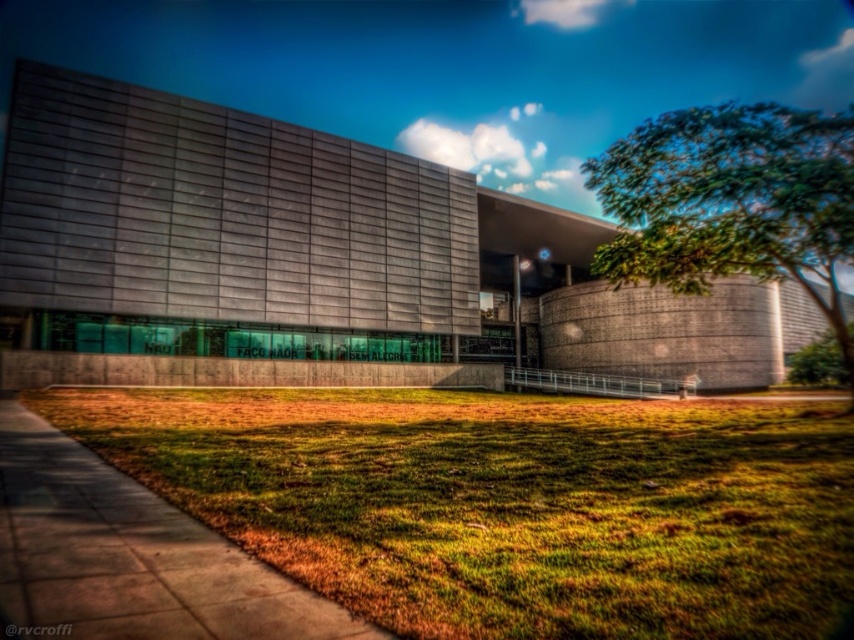
You are standing in front of the modern building and want to take a photo. You notice two points marked on the ground at coordinates point [278,467] and point [800,184]. Which point is closer to your current position?

Point [278,467] is closer to the camera than point [800,184], so the point closer to your current position is point [278,467].

You are standing at the entrance of the building and looking towards the lawn. Which object is closer to you between the green grass at lower center and the green leafy tree at right?

The green grass at lower center is closer to you because it is positioned below the green leafy tree at right, indicating it is nearer in the scene.